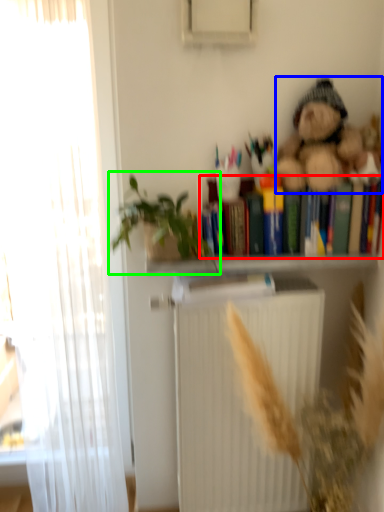
Question: Which is nearer to the book (highlighted by a red box)? teddy bear (highlighted by a blue box) or houseplant (highlighted by a green box).

Choices:
 (A) teddy bear
 (B) houseplant

Answer: (A)